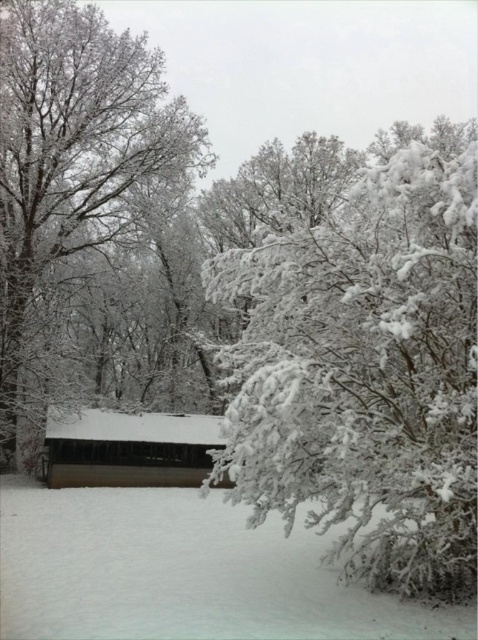
Question: Does white frosty branches at center appear on the left side of white frosty tree at center?

Choices:
 (A) no
 (B) yes

Answer: (A)

Question: Is white fluffy snow at lower center smaller than white frosty tree at center?

Choices:
 (A) no
 (B) yes

Answer: (B)

Question: Estimate the real-world distances between objects in this image. Which object is closer to the white fluffy snow at lower center?

Choices:
 (A) white frosty branches at center
 (B) wooden hut at center

Answer: (A)

Question: Can you confirm if white fluffy snow at lower center is positioned to the left of white frosty tree at center?

Choices:
 (A) yes
 (B) no

Answer: (B)

Question: Among these objects, which one is nearest to the camera?

Choices:
 (A) white fluffy snow at lower center
 (B) white frosty branches at center
 (C) wooden hut at center
 (D) white frosty tree at center

Answer: (B)

Question: Which point is farther from the camera taking this photo?

Choices:
 (A) (63, 467)
 (B) (93, 579)

Answer: (A)